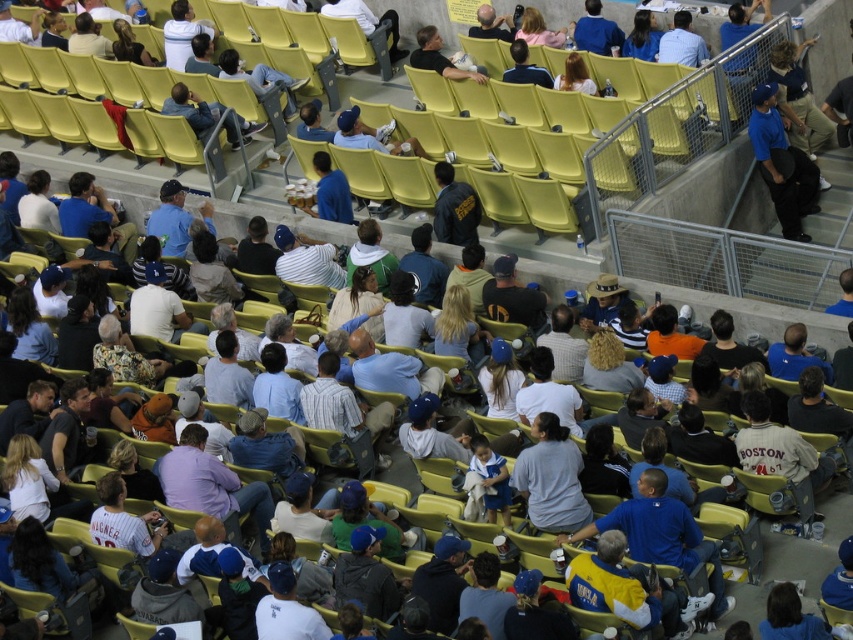
You are a photographer at the stadium and need to capture a photo of the denim jacket at center and the matte blue shirt at center. Which clothing item will appear taller in the photo?

The denim jacket at center will appear taller in the photo because it has a greater height compared to the matte blue shirt at center.

You are a photographer at the stadium and want to capture both the blue matte baseball cap at upper right and the matte blue shirt at center in a single shot. Which object should you focus on first to ensure both are in frame?

The blue matte baseball cap at upper right is larger in size than the matte blue shirt at center, so focusing on the blue matte baseball cap at upper right first will help ensure both are captured in the frame since it takes up more space.

You are a photographer at the stadium and want to capture a photo of the matte black shirt at center without the blue matte baseball cap at upper right blocking it. How should you adjust your camera angle?

The blue matte baseball cap at upper right is in front of the matte black shirt at center. To avoid the cap blocking the shirt, move your camera position backward or to the side to shift the perspective so the shirt becomes visible behind the cap.